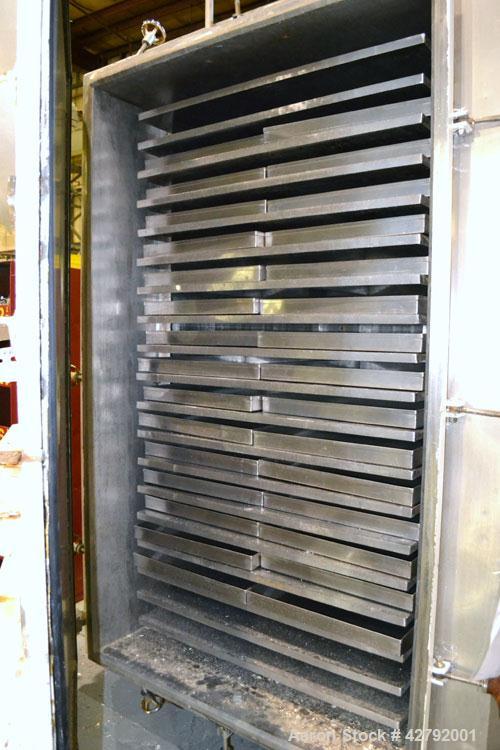
Where is `shelves`? The height and width of the screenshot is (750, 500). shelves is located at coordinates (282, 554), (311, 526), (316, 494), (322, 460).